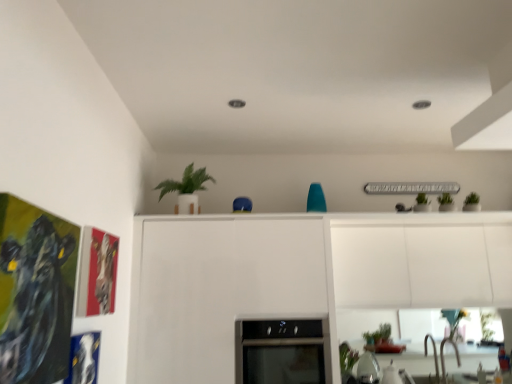
Question: Is green matte plant at upper center behind green matte plant at lower center?

Choices:
 (A) yes
 (B) no

Answer: (B)

Question: Considering the relative sizes of green matte plant at upper center and green matte plant at lower center in the image provided, is green matte plant at upper center shorter than green matte plant at lower center?

Choices:
 (A) yes
 (B) no

Answer: (B)

Question: Does green matte plant at upper center appear on the right side of green matte plant at lower center?

Choices:
 (A) yes
 (B) no

Answer: (B)

Question: Is green matte plant at upper center smaller than green matte plant at lower center?

Choices:
 (A) yes
 (B) no

Answer: (B)

Question: Does green matte plant at upper center appear on the left side of green matte plant at lower center?

Choices:
 (A) yes
 (B) no

Answer: (A)

Question: From the image's perspective, is green matte plant at upper center above green matte plant at lower center?

Choices:
 (A) no
 (B) yes

Answer: (B)

Question: Is black glass oven at center positioned behind green matte plant at lower center?

Choices:
 (A) no
 (B) yes

Answer: (A)

Question: Does black glass oven at center come in front of green matte plant at lower center?

Choices:
 (A) no
 (B) yes

Answer: (B)

Question: From a real-world perspective, is black glass oven at center on top of green matte plant at lower center?

Choices:
 (A) yes
 (B) no

Answer: (A)

Question: Considering the relative sizes of black glass oven at center and green matte plant at lower center in the image provided, is black glass oven at center bigger than green matte plant at lower center?

Choices:
 (A) yes
 (B) no

Answer: (A)

Question: Could you tell me if black glass oven at center is turned towards green matte plant at lower center?

Choices:
 (A) no
 (B) yes

Answer: (A)

Question: From a real-world perspective, does black glass oven at center sit lower than green matte plant at lower center?

Choices:
 (A) no
 (B) yes

Answer: (A)

Question: Considering the relative sizes of metallic silver faucet at lower right and green matte plant at lower center in the image provided, is metallic silver faucet at lower right wider than green matte plant at lower center?

Choices:
 (A) no
 (B) yes

Answer: (B)